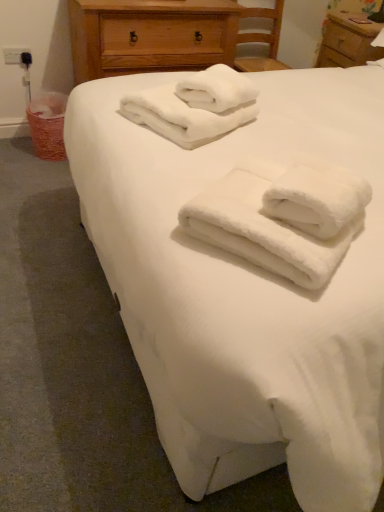
Question: From a real-world perspective, is wooden chest of drawers at upper center above or below white fluffy towels at center, which ranks as the second towel in back-to-front order?

Choices:
 (A) below
 (B) above

Answer: (A)

Question: From their relative heights in the image, would you say wooden chest of drawers at upper center is taller or shorter than white fluffy towels at center, which ranks as the 1th towel in front-to-back order?

Choices:
 (A) tall
 (B) short

Answer: (A)

Question: Which of these objects is positioned farthest from the wooden chest of drawers at upper center?

Choices:
 (A) white fluffy towels at center, placed as the 1th towel when sorted from bottom to top
 (B) white soft bed at center
 (C) wooden nightstand at upper right
 (D) black plastic outlet at upper left
 (E) white soft towels at upper center, which ranks as the 2th towel in front-to-back order

Answer: (A)

Question: Based on their relative distances, which object is farther from the wooden chest of drawers at upper center?

Choices:
 (A) white soft bed at center
 (B) white fluffy towels at center, which ranks as the second towel in top-to-bottom order
 (C) black plastic outlet at upper left
 (D) wooden nightstand at upper right
 (E) white soft towels at upper center, placed as the second towel when sorted from bottom to top

Answer: (B)